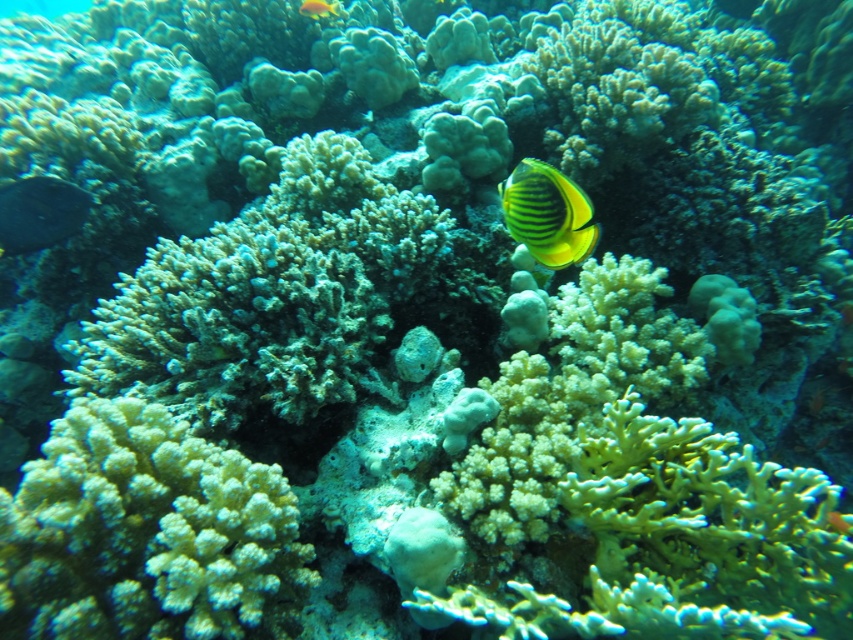
Question: Which of the following is the farthest from the observer?

Choices:
 (A) shiny blue fish at lower left
 (B) yellow striped fish at center

Answer: (A)

Question: Does yellow striped fish at center appear over shiny blue fish at lower left?

Choices:
 (A) no
 (B) yes

Answer: (A)

Question: Which object appears farthest from the camera in this image?

Choices:
 (A) yellow striped fish at upper center
 (B) shiny blue fish at lower left
 (C) yellow striped fish at center

Answer: (A)

Question: Can you confirm if white porous coral at center is smaller than yellow striped fish at upper center?

Choices:
 (A) yes
 (B) no

Answer: (B)

Question: Does white porous coral at center appear on the right side of yellow striped fish at center?

Choices:
 (A) no
 (B) yes

Answer: (A)

Question: Which of the following is the farthest from the observer?

Choices:
 (A) yellow striped fish at center
 (B) yellow striped fish at upper center
 (C) white porous coral at center
 (D) shiny blue fish at lower left

Answer: (B)